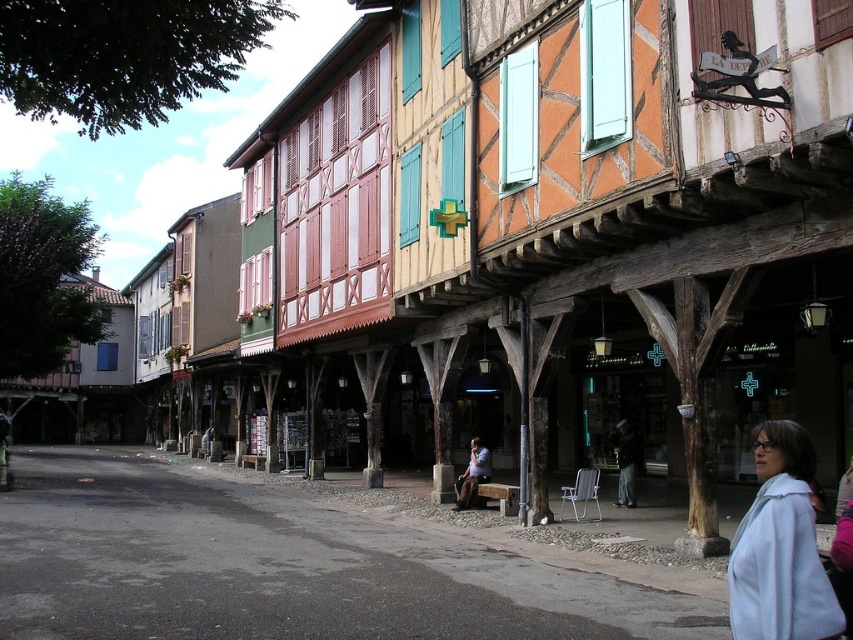
You are a customer looking for a pharmacy in the street scene. You see a light blue woolen coat at lower right and a denim jacket at center. Which direction should you walk to find the pharmacy sign?

The pharmacy is indicated by the green cross sign. The light blue woolen coat at lower right is positioned on the right side of the denim jacket at center. You should walk towards the left from the denim jacket at center to reach the pharmacy sign.

You are standing at the center of the street looking towards the half timbered buildings. There is a light blue woolen coat at lower right. Where is the light blue woolen coat located in relation to the green cross sign pharmacy?

The light blue woolen coat at lower right is located at coordinates point (780, 547), which is to the lower right of the green cross sign pharmacy.

You are a delivery person trying to navigate through the narrow alley between the buildings. You see a light blue woolen coat at lower right and a dark brown leather jacket at center. Which garment is wider and could potentially block your path if you move towards the center?

The light blue woolen coat at lower right might be wider than the dark brown leather jacket at center, so it could potentially block your path if you move towards the center.